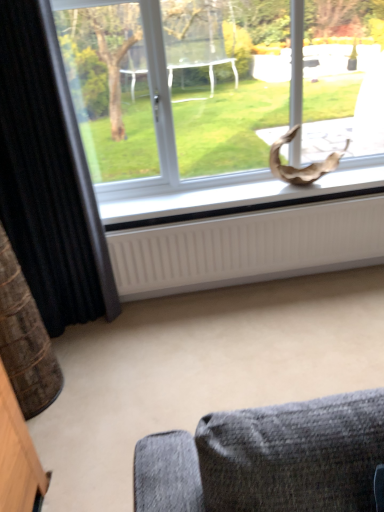
Question: From the image's perspective, is black textured curtain at left located above or below transparent glass window at upper center?

Choices:
 (A) below
 (B) above

Answer: (A)

Question: From their relative heights in the image, would you say black textured curtain at left is taller or shorter than transparent glass window at upper center?

Choices:
 (A) tall
 (B) short

Answer: (A)

Question: Which is farther from the transparent glass window at upper center?

Choices:
 (A) black textured curtain at left
 (B) white matte window sill at center
 (C) white ribbed radiator at lower center

Answer: (A)

Question: Based on their relative distances, which object is nearer to the black textured curtain at left?

Choices:
 (A) white matte window sill at center
 (B) white ribbed radiator at lower center
 (C) transparent glass window at upper center

Answer: (A)